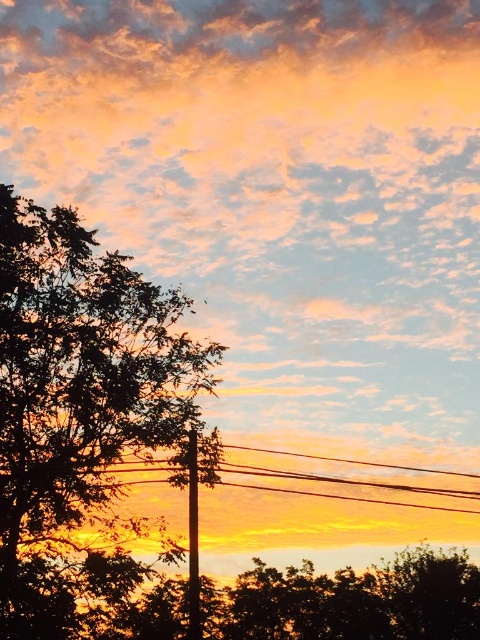
You are standing in the sunset scene and want to take a photo of the green leafy tree at left. Where should you position yourself to capture the tree in the frame?

The green leafy tree at left is located at point 0.658 on the horizontal axis and 0.175 on the vertical axis. To capture it in your photo, position yourself so the camera is aligned with these coordinates.

You are an electrician inspecting a utility pole in the sunset scene. You notice two objects at the center of the image. Which one is positioned higher between the black wire at center and the smooth black pole at center?

The black wire at center is located above the smooth black pole at center, so the black wire at center is positioned higher.

You are an artist planning to paint the sunset scene. You want to ensure the black wire at center and smooth black pole at center are accurately sized in your painting. Which object should you make larger in your artwork?

The black wire at center should be made larger in the artwork since it has a larger size compared to the smooth black pole at center according to the description.